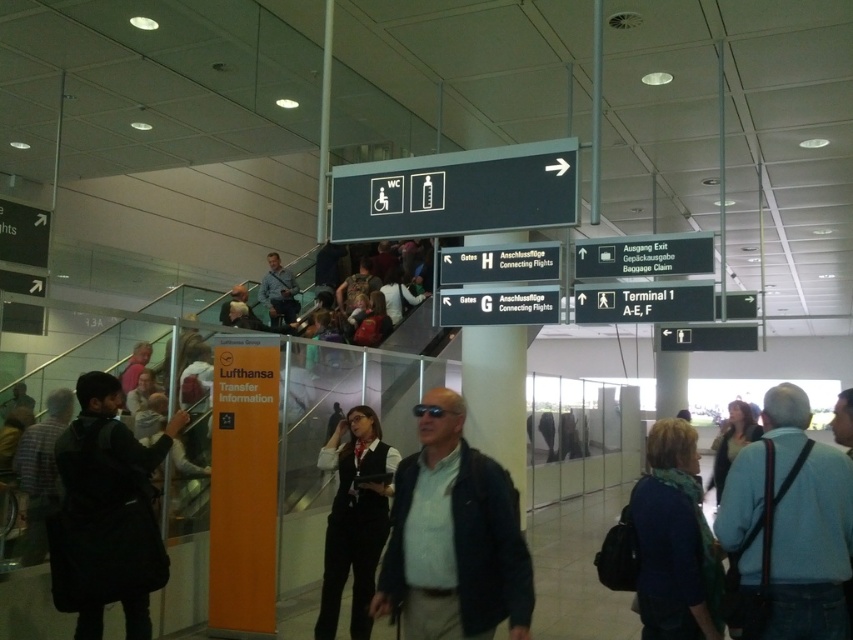
You are a photographer trying to capture a photo of the light blue shirt at center and the white plastic sign at upper center. Based on their sizes in the image, which one would appear more prominent in your photo?

The light blue shirt at center is bigger than the white plastic sign at upper center, so it would appear more prominent in the photo.

You are standing in the airport terminal and want to take a photo of the two points marked in the image. Which point, point 1 at coordinates (840, 593) or point 2 at coordinates (695, 531), will appear larger in your photo?

Point 1 at coordinates (840, 593) will appear larger in the photo because it is closer to the camera than point 2 at coordinates (695, 531).